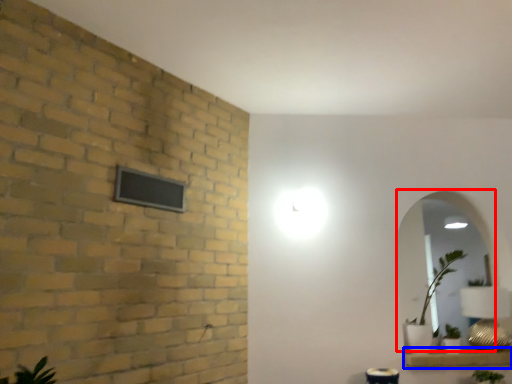
Question: Which object is further to the camera taking this photo, mirror (highlighted by a red box) or window sill (highlighted by a blue box)?

Choices:
 (A) mirror
 (B) window sill

Answer: (A)